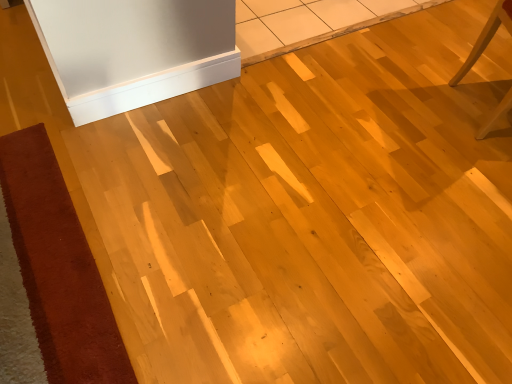
Question: Visually, is light wood chair at right positioned to the left or to the right of velvet-like brown mat at lower left?

Choices:
 (A) right
 (B) left

Answer: (A)

Question: Is point (508, 29) positioned closer to the camera than point (120, 367)?

Choices:
 (A) farther
 (B) closer

Answer: (A)

Question: Which object is positioned closest to the white glossy baseboard at upper center?

Choices:
 (A) light wood chair at right
 (B) velvet-like brown mat at lower left

Answer: (B)

Question: Which is nearer to the white glossy baseboard at upper center?

Choices:
 (A) light wood chair at right
 (B) velvet-like brown mat at lower left

Answer: (B)